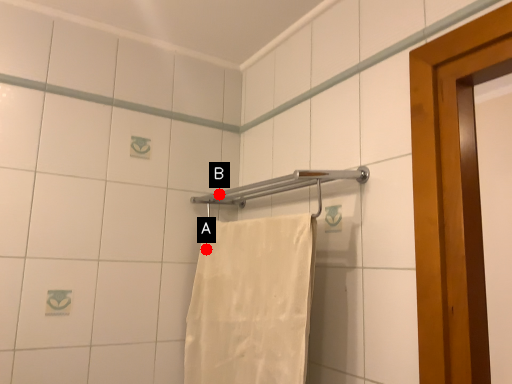
Question: Two points are circled on the image, labeled by A and B beside each circle. Among these points, which one is nearest to the camera?

Choices:
 (A) A is closer
 (B) B is closer

Answer: (A)